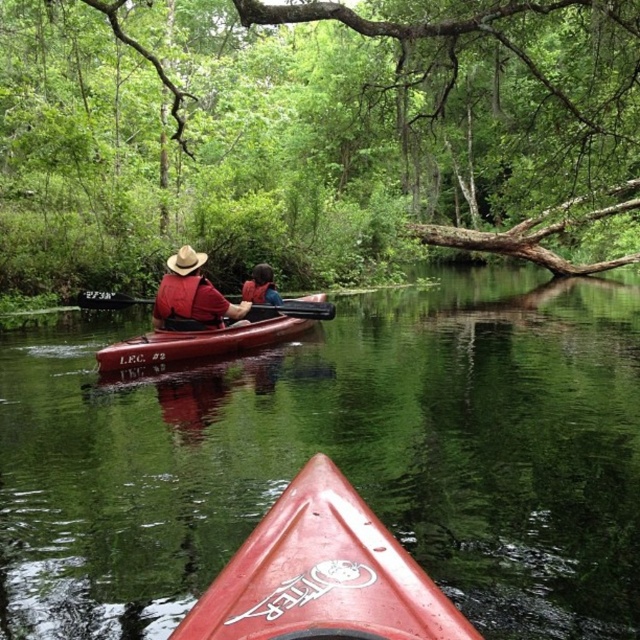
Question: Can you confirm if red plastic kayak at center is wider than smooth brown log at center?

Choices:
 (A) no
 (B) yes

Answer: (A)

Question: Based on their relative distances, which object is nearer to the matte red kayak at center?

Choices:
 (A) brown straw cowboy hat at center
 (B) blue life vest at center

Answer: (A)

Question: Can you confirm if smooth brown log at center is positioned above smooth black paddle at center?

Choices:
 (A) yes
 (B) no

Answer: (A)

Question: Among these objects, which one is nearest to the camera?

Choices:
 (A) red plastic kayak at center
 (B) blue life vest at center
 (C) matte red kayak at center
 (D) brown straw cowboy hat at center

Answer: (C)

Question: Which point is farther to the camera?

Choices:
 (A) (253, 301)
 (B) (225, 340)

Answer: (A)

Question: Can you confirm if red plastic kayak at center is positioned to the right of brown straw cowboy hat at center?

Choices:
 (A) no
 (B) yes

Answer: (B)